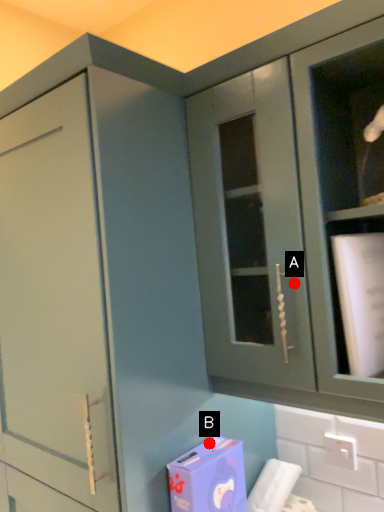
Question: Two points are circled on the image, labeled by A and B beside each circle. Which point is closer to the camera?

Choices:
 (A) A is closer
 (B) B is closer

Answer: (A)